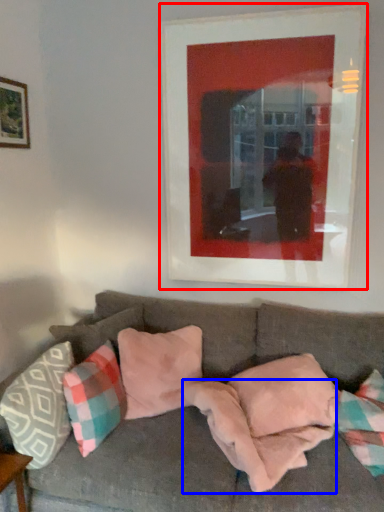
Question: Which object is further to the camera taking this photo, picture frame (highlighted by a red box) or blanket (highlighted by a blue box)?

Choices:
 (A) picture frame
 (B) blanket

Answer: (A)